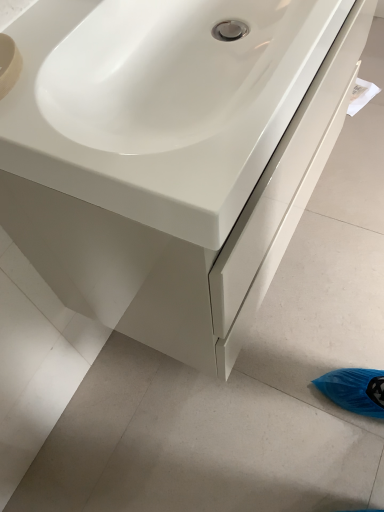
Question: Should I look upward or downward to see white glossy cabinet at center?

Choices:
 (A) up
 (B) down

Answer: (A)